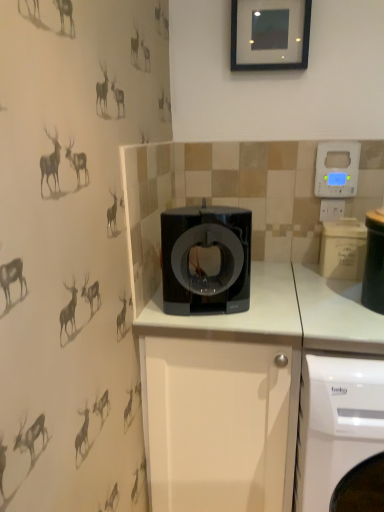
Question: Can we say white glossy washing machine at lower right lies outside white plastic electric outlet at upper right?

Choices:
 (A) no
 (B) yes

Answer: (B)

Question: Does white glossy washing machine at lower right turn towards white plastic electric outlet at upper right?

Choices:
 (A) yes
 (B) no

Answer: (B)

Question: Does white glossy washing machine at lower right appear on the right side of white plastic electric outlet at upper right?

Choices:
 (A) yes
 (B) no

Answer: (A)

Question: Can you confirm if white glossy washing machine at lower right is thinner than white plastic electric outlet at upper right?

Choices:
 (A) yes
 (B) no

Answer: (B)

Question: Is white glossy washing machine at lower right touching white plastic electric outlet at upper right?

Choices:
 (A) yes
 (B) no

Answer: (B)

Question: From a real-world perspective, is white glossy washing machine at lower right over white plastic electric outlet at upper right?

Choices:
 (A) yes
 (B) no

Answer: (B)

Question: Is black plastic container at right wider than white matte cabinet at center?

Choices:
 (A) no
 (B) yes

Answer: (A)

Question: From the image's perspective, is black plastic container at right on white matte cabinet at center?

Choices:
 (A) no
 (B) yes

Answer: (B)

Question: Considering the relative positions of black plastic container at right and white matte cabinet at center in the image provided, is black plastic container at right behind white matte cabinet at center?

Choices:
 (A) yes
 (B) no

Answer: (B)

Question: Is black plastic container at right at the left side of white matte cabinet at center?

Choices:
 (A) no
 (B) yes

Answer: (A)

Question: Is black plastic container at right located outside white matte cabinet at center?

Choices:
 (A) yes
 (B) no

Answer: (A)

Question: Considering the relative sizes of black plastic container at right and white matte cabinet at center in the image provided, is black plastic container at right taller than white matte cabinet at center?

Choices:
 (A) yes
 (B) no

Answer: (B)

Question: Considering the relative sizes of white matte cabinet at center and blue plastic thermostat at upper right in the image provided, is white matte cabinet at center taller than blue plastic thermostat at upper right?

Choices:
 (A) yes
 (B) no

Answer: (A)